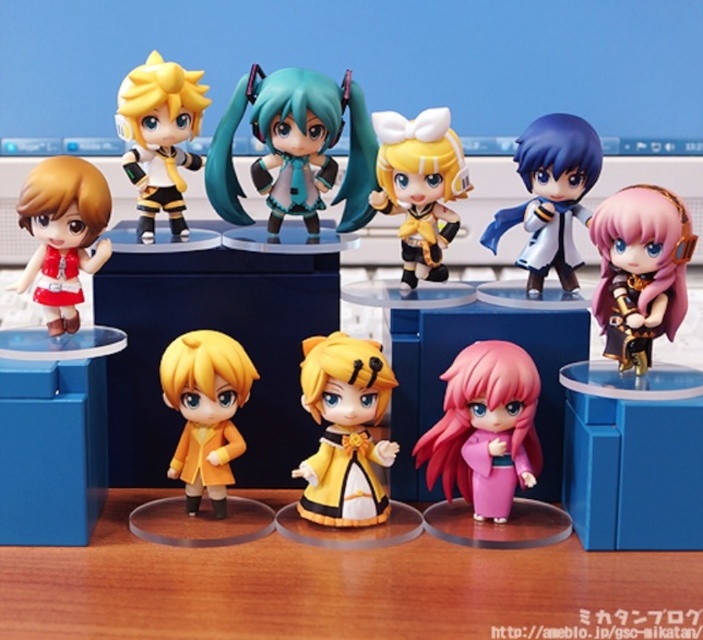
Can you confirm if blue plastic table at lower right is positioned below satin blue coat at upper right?

Yes.

Where is `blue plastic table at lower right`? The height and width of the screenshot is (640, 703). blue plastic table at lower right is located at coordinates (632, 456).

Between blue plastic table at lower right and matte yellow jacket at upper left, which one appears on the right side from the viewer's perspective?

blue plastic table at lower right

Which is below, blue plastic table at lower right or matte yellow jacket at upper left?

blue plastic table at lower right

Is point (626, 484) in front of point (138, 129)?

Yes.

Where is `blue plastic table at lower right`? blue plastic table at lower right is located at coordinates (632, 456).

Is point (657, 426) farther from viewer compared to point (486, 506)?

No, (657, 426) is in front of (486, 506).

Find the location of a particular element. blue plastic table at lower right is located at coordinates (632, 456).